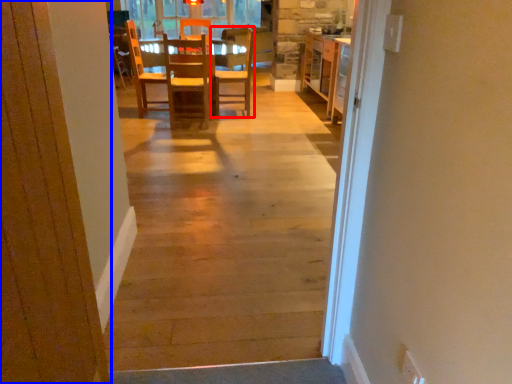
Question: Among these objects, which one is nearest to the camera, chair (highlighted by a red box) or door (highlighted by a blue box)?

Choices:
 (A) chair
 (B) door

Answer: (B)